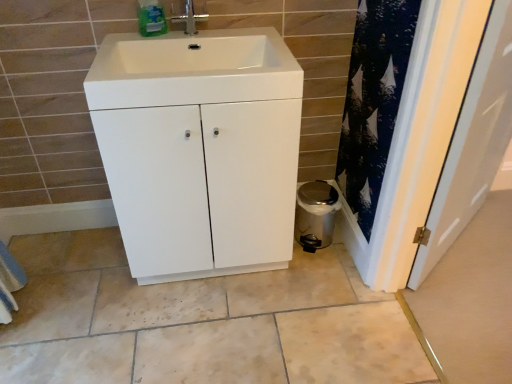
Where is `vacant space in front of white glossy door at right`? vacant space in front of white glossy door at right is located at coordinates (472, 299).